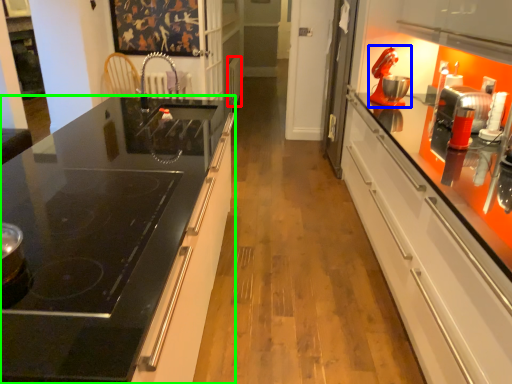
Question: Estimate the real-world distances between objects in this image. Which object is closer to appliance (highlighted by a red box), home appliance (highlighted by a blue box) or countertop (highlighted by a green box)?

Choices:
 (A) home appliance
 (B) countertop

Answer: (A)